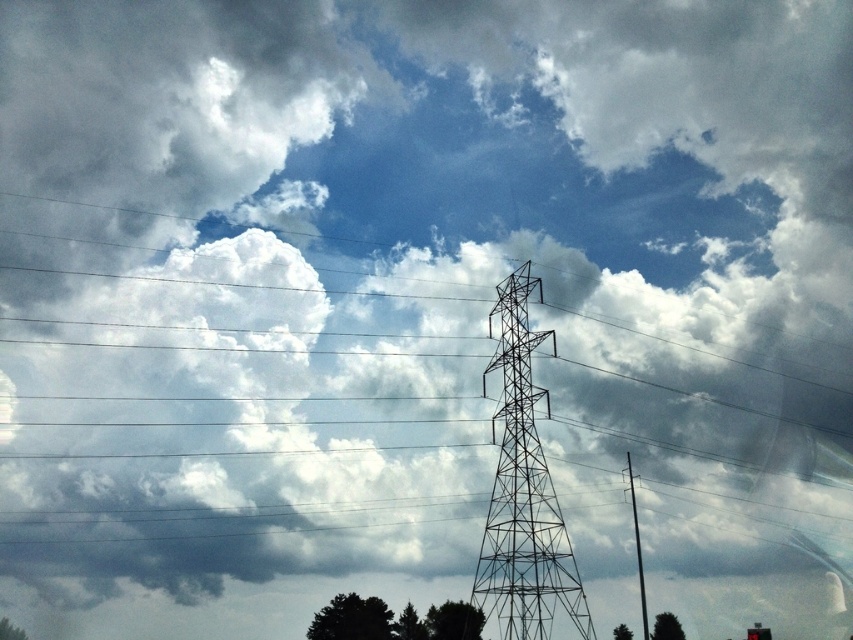
Question: Is metallic wire tower at center thinner than metallic gray pole at center-right?

Choices:
 (A) no
 (B) yes

Answer: (A)

Question: Which object is closer to the camera taking this photo?

Choices:
 (A) metallic gray pole at center-right
 (B) metallic wire tower at center

Answer: (B)

Question: Which of the following is the farthest from the observer?

Choices:
 (A) (640, 570)
 (B) (552, 516)

Answer: (A)

Question: Does metallic wire tower at center have a larger size compared to metallic gray pole at center-right?

Choices:
 (A) no
 (B) yes

Answer: (B)

Question: Where is metallic wire tower at center located in relation to metallic gray pole at center-right in the image?

Choices:
 (A) above
 (B) below

Answer: (A)